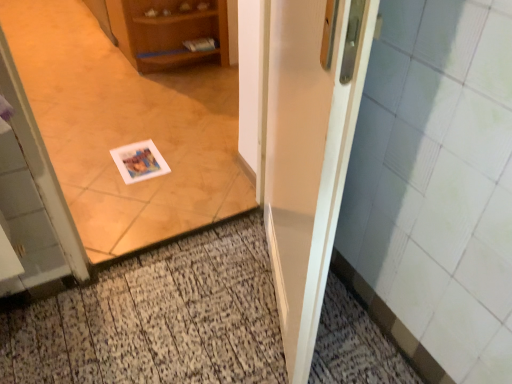
I want to click on free point above white paper postcard at center (from a real-world perspective), so click(147, 158).